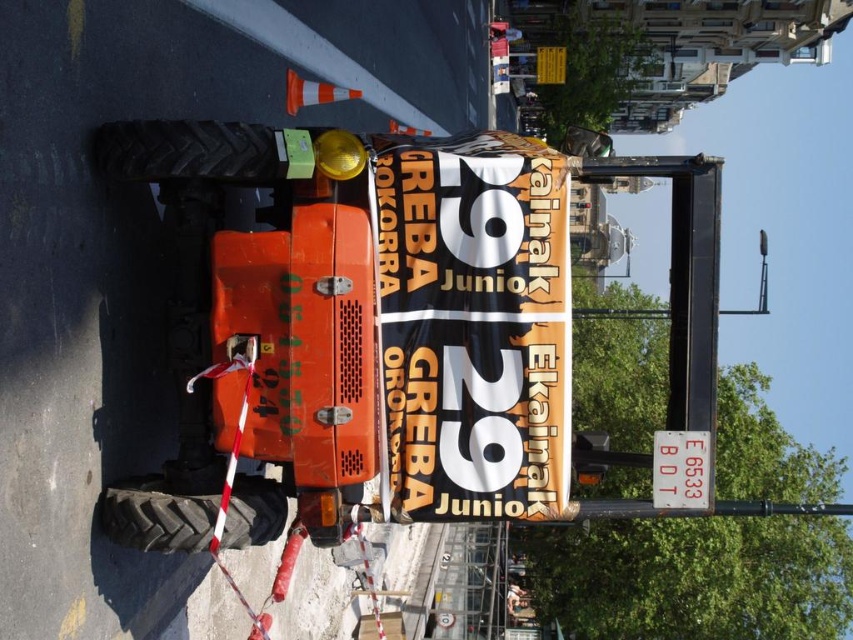
Question: Which object is positioned closest to the white plastic sign at center?

Choices:
 (A) black rubber tire at left
 (B) orange vinyl banner at center
 (C) rubber tread tire at lower left
 (D) metallic silver ladder at lower center

Answer: (B)

Question: Can you confirm if orange vinyl banner at center is positioned below white plastic sign at center?

Choices:
 (A) no
 (B) yes

Answer: (A)

Question: Which point is closer to the camera taking this photo?

Choices:
 (A) (x=474, y=605)
 (B) (x=403, y=177)
 (C) (x=216, y=131)

Answer: (C)

Question: Does orange vinyl banner at center have a smaller size compared to black rubber tire at left?

Choices:
 (A) yes
 (B) no

Answer: (B)

Question: Which point is farther from the camera taking this photo?

Choices:
 (A) (488, 628)
 (B) (165, 544)
 (C) (689, 449)
 (D) (384, 372)

Answer: (A)

Question: Can you confirm if orange vinyl banner at center is positioned to the left of metallic silver ladder at lower center?

Choices:
 (A) no
 (B) yes

Answer: (B)